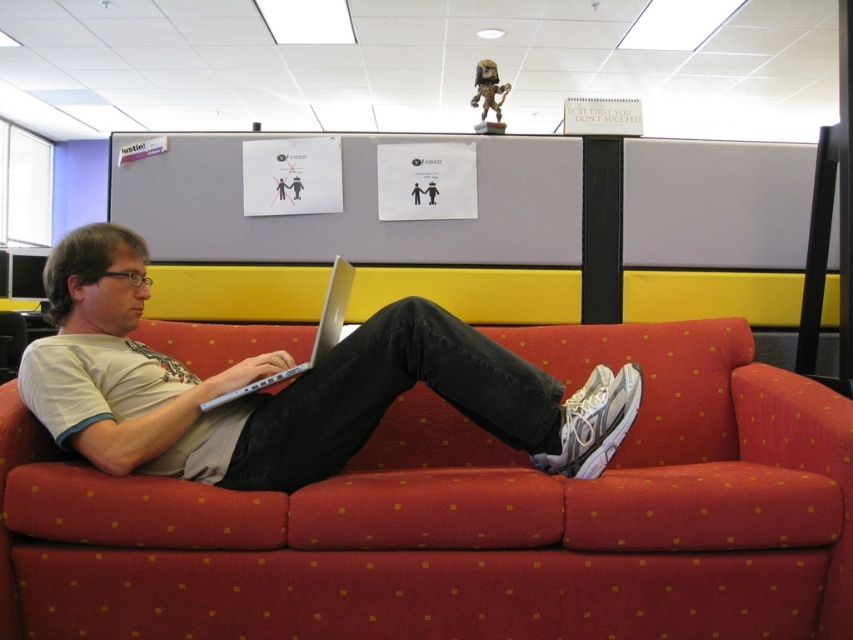
Question: Which point is closer to the camera?

Choices:
 (A) red fabric couch at center
 (B) silver metallic laptop at center
 (C) white matte shirt at center

Answer: (A)

Question: Does red fabric couch at center have a lesser width compared to silver metallic laptop at center?

Choices:
 (A) yes
 (B) no

Answer: (B)

Question: Can you confirm if red fabric couch at center is positioned below silver metallic laptop at center?

Choices:
 (A) yes
 (B) no

Answer: (A)

Question: Considering the real-world distances, which object is closest to the red fabric couch at center?

Choices:
 (A) silver metallic laptop at center
 (B) white matte shirt at center

Answer: (B)

Question: Is red fabric couch at center closer to camera compared to white matte shirt at center?

Choices:
 (A) no
 (B) yes

Answer: (B)

Question: Which point is farther to the camera?

Choices:
 (A) (575, 576)
 (B) (331, 328)
 (C) (244, 404)

Answer: (C)